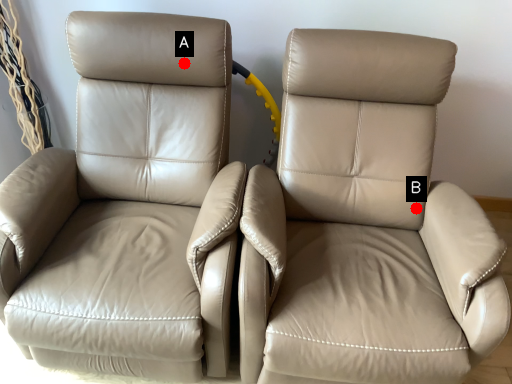
Question: Two points are circled on the image, labeled by A and B beside each circle. Which of the following is the closest to the observer?

Choices:
 (A) A is closer
 (B) B is closer

Answer: (A)